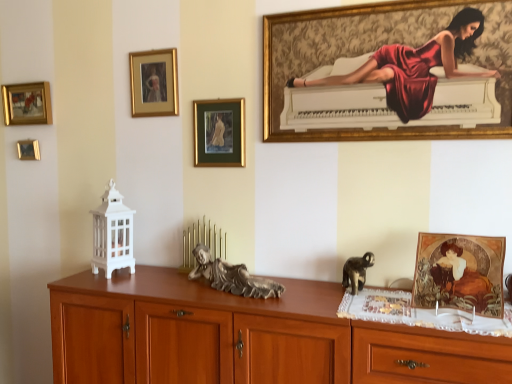
Question: Is wooden drawer at lower right positioned in front of gold-framed painting at upper center, the second picture frame in the right-to-left sequence?

Choices:
 (A) yes
 (B) no

Answer: (A)

Question: Can you confirm if wooden drawer at lower right is thinner than gold-framed painting at upper center, the second picture frame in the right-to-left sequence?

Choices:
 (A) no
 (B) yes

Answer: (A)

Question: Can you confirm if wooden drawer at lower right is positioned to the left of gold-framed painting at upper center, arranged as the 4th picture frame when viewed from the left?

Choices:
 (A) yes
 (B) no

Answer: (B)

Question: Is wooden drawer at lower right at the right side of gold-framed painting at upper center, the second picture frame in the right-to-left sequence?

Choices:
 (A) yes
 (B) no

Answer: (A)

Question: Does wooden drawer at lower right have a larger size compared to gold-framed painting at upper center, the second picture frame in the right-to-left sequence?

Choices:
 (A) no
 (B) yes

Answer: (B)

Question: Is wooden drawer at lower right looking in the opposite direction of gold-framed painting at upper center, the second picture frame in the right-to-left sequence?

Choices:
 (A) no
 (B) yes

Answer: (A)

Question: Can you confirm if shiny metallic cat at lower right, positioned as the 1th animal in right-to-left order, is smaller than silver metallic statue at center, the 2th animal in the right-to-left sequence?

Choices:
 (A) no
 (B) yes

Answer: (B)

Question: From a real-world perspective, is shiny metallic cat at lower right, positioned as the 1th animal in right-to-left order, under silver metallic statue at center, the 2th animal in the right-to-left sequence?

Choices:
 (A) no
 (B) yes

Answer: (B)

Question: Can you confirm if shiny metallic cat at lower right, marked as the 2th animal in a left-to-right arrangement, is bigger than silver metallic statue at center, positioned as the first animal in left-to-right order?

Choices:
 (A) no
 (B) yes

Answer: (A)

Question: Can you confirm if shiny metallic cat at lower right, marked as the 2th animal in a left-to-right arrangement, is shorter than silver metallic statue at center, the 2th animal in the right-to-left sequence?

Choices:
 (A) no
 (B) yes

Answer: (B)

Question: Can you confirm if shiny metallic cat at lower right, marked as the 2th animal in a left-to-right arrangement, is positioned to the right of silver metallic statue at center, positioned as the first animal in left-to-right order?

Choices:
 (A) no
 (B) yes

Answer: (B)

Question: Is silver metallic statue at center, positioned as the first animal in left-to-right order, inside shiny metallic cat at lower right, marked as the 2th animal in a left-to-right arrangement?

Choices:
 (A) yes
 (B) no

Answer: (B)

Question: Is gold-framed painting at upper left, marked as the fourth picture frame in a right-to-left arrangement, facing away from silver metallic statue at center, positioned as the first animal in left-to-right order?

Choices:
 (A) yes
 (B) no

Answer: (B)